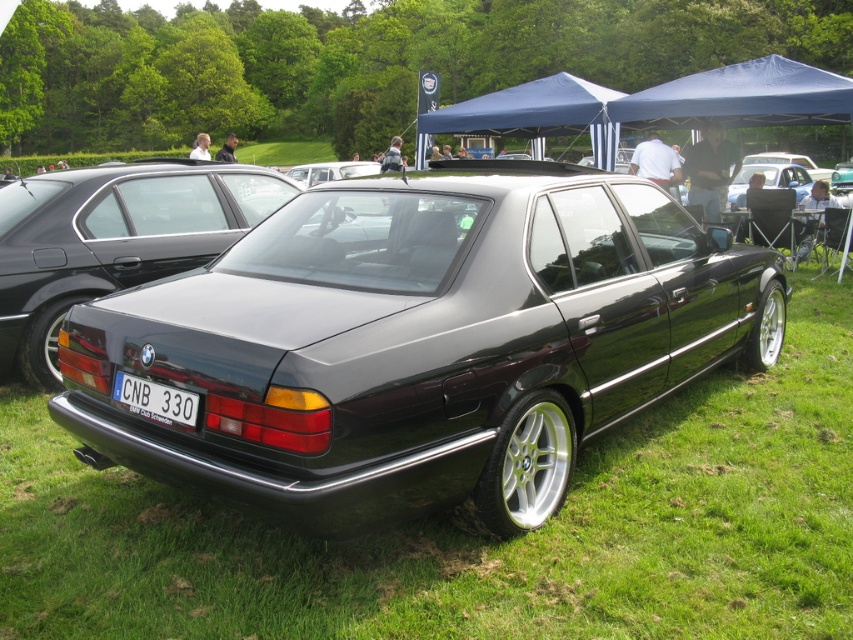
Between glossy black sedan at center and white plastic license plate at center, which one has more height?

glossy black sedan at center is taller.

Is glossy black sedan at center to the left of white plastic license plate at center from the viewer's perspective?

Incorrect, glossy black sedan at center is not on the left side of white plastic license plate at center.

Is point (374, 412) farther from camera compared to point (142, 412)?

No, (374, 412) is closer to viewer.

Locate an element on the screen. The height and width of the screenshot is (640, 853). glossy black sedan at center is located at coordinates (421, 342).